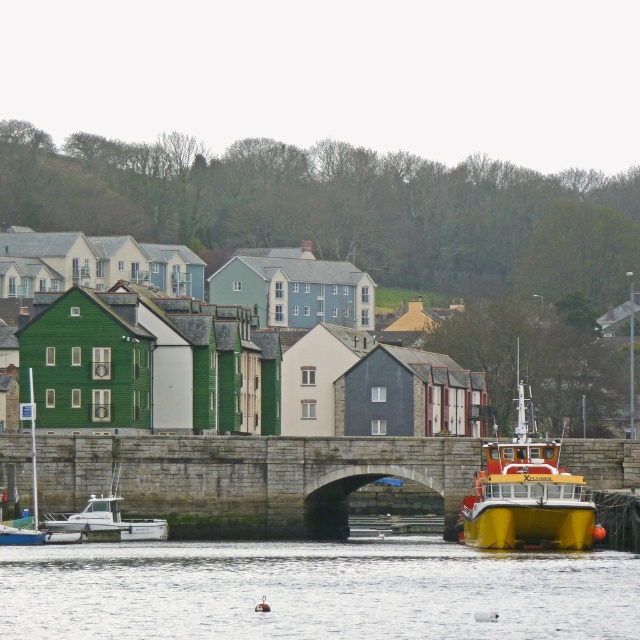
Measure the distance between point (278, 483) and camera.

A distance of 127.67 meters exists between point (278, 483) and camera.

Between stone bridge at center and yellow matte boat at right, which one is positioned higher?

yellow matte boat at right

Which is behind, point (136, 502) or point (483, 474)?

Point (136, 502)

Identify the location of stone bridge at center. This screenshot has width=640, height=640. (257, 480).

Where is `transparent water at lower center`? The width and height of the screenshot is (640, 640). transparent water at lower center is located at coordinates (314, 589).

Does transparent water at lower center appear over stone bridge at center?

Actually, transparent water at lower center is below stone bridge at center.

The image size is (640, 640). What do you see at coordinates (314, 589) in the screenshot?
I see `transparent water at lower center` at bounding box center [314, 589].

The height and width of the screenshot is (640, 640). Find the location of `transparent water at lower center`. transparent water at lower center is located at coordinates (314, 589).

Is transparent water at lower center bigger than yellow matte boat at right?

Incorrect, transparent water at lower center is not larger than yellow matte boat at right.

Can you confirm if transparent water at lower center is taller than yellow matte boat at right?

→ In fact, transparent water at lower center may be shorter than yellow matte boat at right.

Is point (362, 573) farther from camera compared to point (566, 516)?

No, it is not.

At what (x,y) coordinates should I click in order to perform the action: click on transparent water at lower center. Please return your answer as a coordinate pair (x, y). This screenshot has height=640, width=640. Looking at the image, I should click on 314,589.